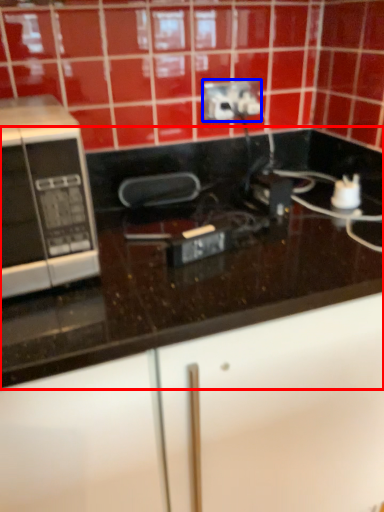
Question: Which of the following is the farthest to the observer, countertop (highlighted by a red box) or power plugs and sockets (highlighted by a blue box)?

Choices:
 (A) countertop
 (B) power plugs and sockets

Answer: (B)